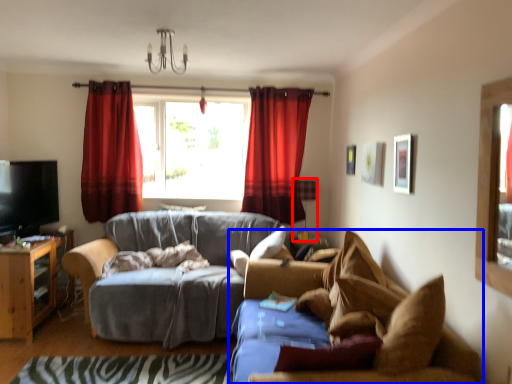
Question: Among these objects, which one is farthest to the camera, lamp (highlighted by a red box) or studio couch (highlighted by a blue box)?

Choices:
 (A) lamp
 (B) studio couch

Answer: (A)